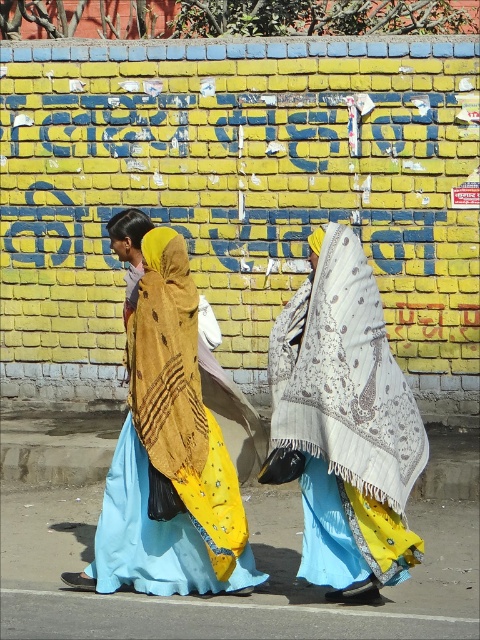
You are a tailor who needs to determine which shawl to use for a customer who prefers a wider accessory. Based on the image, which shawl between the yellow fabric shawl at center and the brown textured shawl at center should you recommend?

The yellow fabric shawl at center has a larger width than the brown textured shawl at center, so it would be the better recommendation for a wider accessory.

You are an observer standing in front of the two women. Both are wearing shawls. Which shawl is taller between the white textured shawl at center and the yellow fabric shawl at center?

The white textured shawl at center is taller than the yellow fabric shawl at center.

You are a tailor observing two women walking past a wall. The women are wearing yellow fabric shawl at center and brown textured shawl at center. Which shawl would require more fabric to make?

The yellow fabric shawl at center requires more fabric to make because it is larger in size than the brown textured shawl at center.